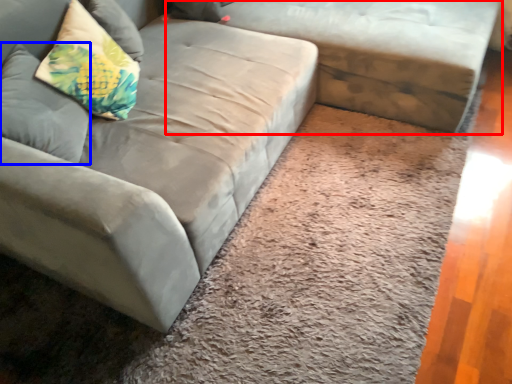
Question: Which point is further to the camera, studio couch (highlighted by a red box) or pillow (highlighted by a blue box)?

Choices:
 (A) studio couch
 (B) pillow

Answer: (A)